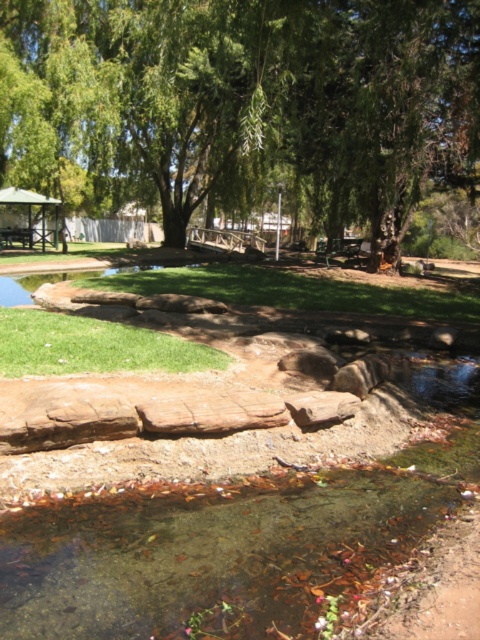
Question: Which object is farther from the camera taking this photo?

Choices:
 (A) green grass at lower left
 (B) green grass at center
 (C) green leafy tree at upper center

Answer: (B)

Question: Can you confirm if green grass at center is smaller than green grass at lower left?

Choices:
 (A) no
 (B) yes

Answer: (A)

Question: Which of the following is the farthest from the observer?

Choices:
 (A) green leafy tree at upper center
 (B) green grass at lower left

Answer: (A)

Question: Is green leafy tree at upper center positioned in front of green grass at center?

Choices:
 (A) no
 (B) yes

Answer: (B)

Question: Where is green grass at center located in relation to green grass at lower left in the image?

Choices:
 (A) above
 (B) below

Answer: (A)

Question: Which point is closer to the camera?

Choices:
 (A) (276, 120)
 (B) (223, 275)
 (C) (108, 358)

Answer: (C)